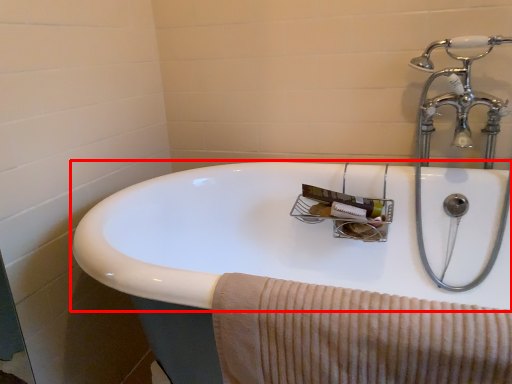
Question: From the image's perspective, considering the relative positions of sink (annotated by the red box) and bath towel in the image provided, where is sink (annotated by the red box) located with respect to the staircase?

Choices:
 (A) below
 (B) above

Answer: (A)